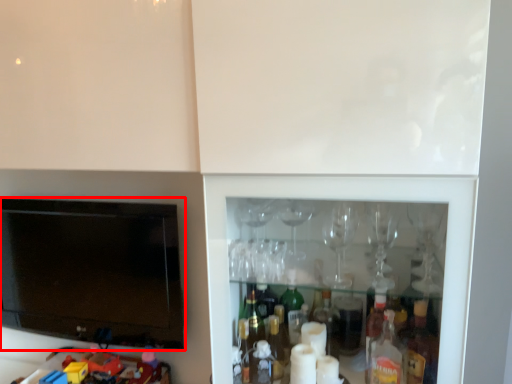
Question: In this image, where is television (annotated by the red box) located relative to toy?

Choices:
 (A) left
 (B) right

Answer: (A)